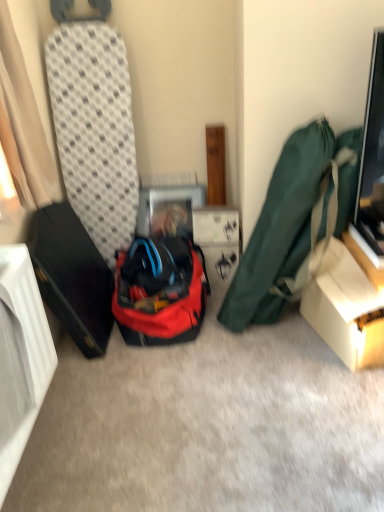
Question: Does white cardboard box at center turn towards red fabric backpack at center?

Choices:
 (A) yes
 (B) no

Answer: (B)

Question: Is white cardboard box at center outside of red fabric backpack at center?

Choices:
 (A) yes
 (B) no

Answer: (A)

Question: Is white cardboard box at center at the right side of red fabric backpack at center?

Choices:
 (A) no
 (B) yes

Answer: (B)

Question: Can you confirm if white cardboard box at center is taller than red fabric backpack at center?

Choices:
 (A) no
 (B) yes

Answer: (A)

Question: Is white cardboard box at center positioned before red fabric backpack at center?

Choices:
 (A) yes
 (B) no

Answer: (B)

Question: Is white cardboard box at center with red fabric backpack at center?

Choices:
 (A) no
 (B) yes

Answer: (A)

Question: Does white cardboard box at center have a smaller size compared to beige fabric curtain at left?

Choices:
 (A) no
 (B) yes

Answer: (B)

Question: Is beige fabric curtain at left inside white cardboard box at center?

Choices:
 (A) no
 (B) yes

Answer: (A)

Question: From a real-world perspective, is white cardboard box at center physically above beige fabric curtain at left?

Choices:
 (A) yes
 (B) no

Answer: (B)

Question: Can you confirm if white cardboard box at center is bigger than beige fabric curtain at left?

Choices:
 (A) no
 (B) yes

Answer: (A)

Question: Can you confirm if white cardboard box at center is positioned to the left of beige fabric curtain at left?

Choices:
 (A) yes
 (B) no

Answer: (B)

Question: Is white cardboard box at center oriented away from beige fabric curtain at left?

Choices:
 (A) no
 (B) yes

Answer: (A)

Question: Considering the relative sizes of red fabric backpack at center and white cardboard box at center in the image provided, is red fabric backpack at center thinner than white cardboard box at center?

Choices:
 (A) yes
 (B) no

Answer: (B)